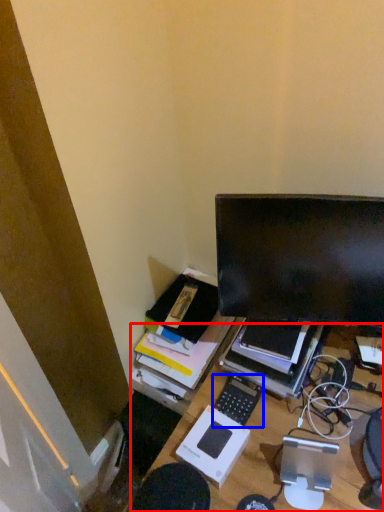
Question: Which object appears farthest to the camera in this image, desk (highlighted by a red box) or computer keyboard (highlighted by a blue box)?

Choices:
 (A) desk
 (B) computer keyboard

Answer: (B)